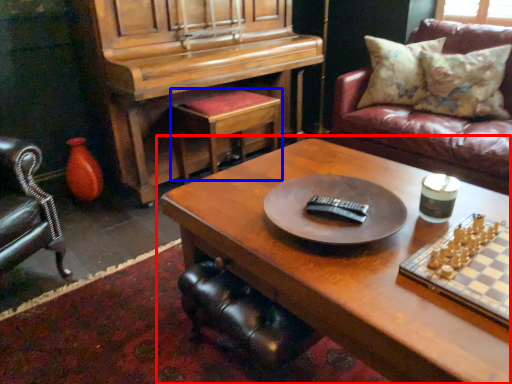
Question: Which of the following is the farthest to the observer, coffee table (highlighted by a red box) or stool (highlighted by a blue box)?

Choices:
 (A) coffee table
 (B) stool

Answer: (B)